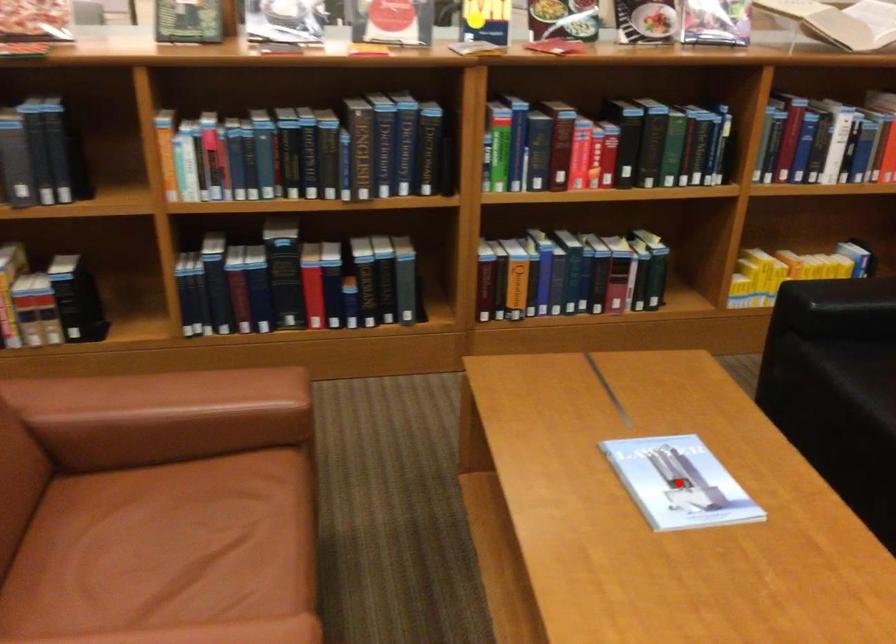
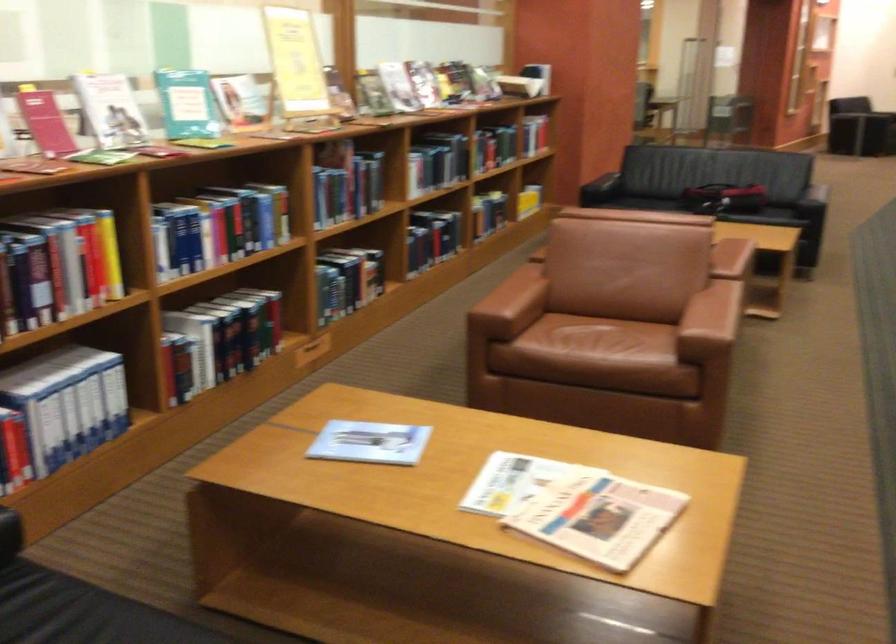
Question: I am providing you with two images of the same scene from different viewpoints. A red point is marked on the first image. Can you still see the location of the red point in image 2?

Choices:
 (A) Yes
 (B) No

Answer: (B)